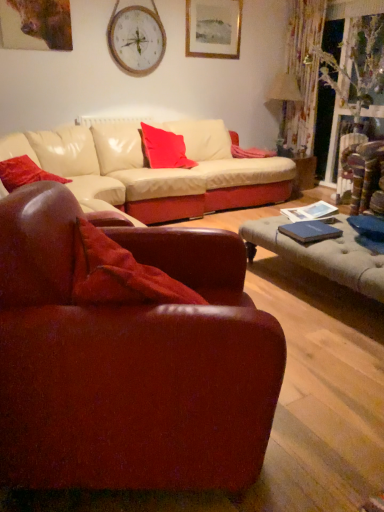
Question: Should I look upward or downward to see matte beige lampshade at upper right?

Choices:
 (A) up
 (B) down

Answer: (A)

Question: Considering the relative sizes of matte red pillow at left, the 1th pillow when ordered from left to right, and leather armchair at lower left in the image provided, is matte red pillow at left, the 1th pillow when ordered from left to right, smaller than leather armchair at lower left?

Choices:
 (A) yes
 (B) no

Answer: (A)

Question: Is matte red pillow at left, the 1th pillow when ordered from left to right, to the right of leather armchair at lower left from the viewer's perspective?

Choices:
 (A) yes
 (B) no

Answer: (B)

Question: Considering the relative sizes of matte red pillow at left, the second pillow when ordered from top to bottom, and leather armchair at lower left in the image provided, is matte red pillow at left, the second pillow when ordered from top to bottom, wider than leather armchair at lower left?

Choices:
 (A) no
 (B) yes

Answer: (A)

Question: From a real-world perspective, is matte red pillow at left, which is the 1th pillow from bottom to top, physically above leather armchair at lower left?

Choices:
 (A) yes
 (B) no

Answer: (A)

Question: Is matte red pillow at left, marked as the first pillow in a front-to-back arrangement, positioned beyond the bounds of leather armchair at lower left?

Choices:
 (A) no
 (B) yes

Answer: (B)

Question: Is matte red pillow at left, the second pillow in the back-to-front sequence, taller than leather armchair at lower left?

Choices:
 (A) no
 (B) yes

Answer: (A)

Question: Is wooden picture frame at upper center surrounding blue matte book at lower right?

Choices:
 (A) no
 (B) yes

Answer: (A)

Question: Can you confirm if wooden picture frame at upper center is thinner than blue matte book at lower right?

Choices:
 (A) no
 (B) yes

Answer: (B)

Question: From a real-world perspective, is wooden picture frame at upper center under blue matte book at lower right?

Choices:
 (A) yes
 (B) no

Answer: (B)

Question: Is wooden picture frame at upper center shorter than blue matte book at lower right?

Choices:
 (A) yes
 (B) no

Answer: (B)

Question: Considering the relative sizes of wooden picture frame at upper center and blue matte book at lower right in the image provided, is wooden picture frame at upper center bigger than blue matte book at lower right?

Choices:
 (A) no
 (B) yes

Answer: (B)

Question: Can you confirm if wooden picture frame at upper center is wider than blue matte book at lower right?

Choices:
 (A) yes
 (B) no

Answer: (B)

Question: Does wooden clock at upper center appear on the left side of leather armchair at lower left?

Choices:
 (A) yes
 (B) no

Answer: (A)